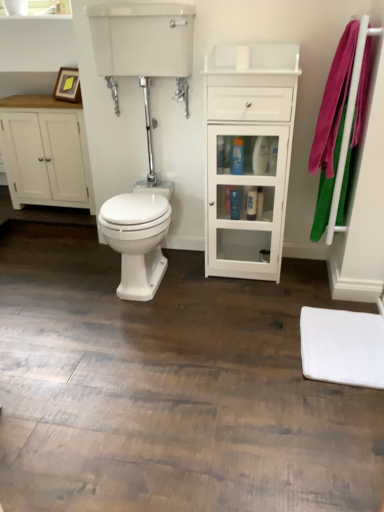
At what (x,y) coordinates should I click in order to perform the action: click on vacant space behind white matte mat at lower right. Please return your answer as a coordinate pair (x, y). Looking at the image, I should click on (294, 297).